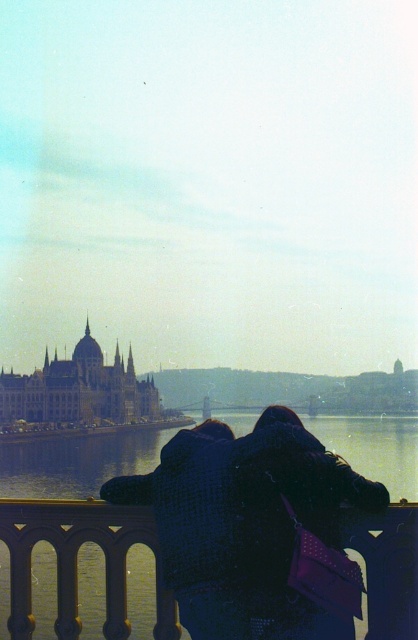
Is clear water at lower center further to camera compared to matte gold dome at center?

That is False.

What do you see at coordinates (73, 465) in the screenshot? I see `clear water at lower center` at bounding box center [73, 465].

Identify the location of clear water at lower center. Image resolution: width=418 pixels, height=640 pixels. (73, 465).

Can you confirm if clear water at lower center is positioned to the right of golden stone palace at lower left?

Yes, clear water at lower center is to the right of golden stone palace at lower left.

Is point (73, 458) positioned behind point (79, 356)?

No, it is in front of (79, 356).

This screenshot has height=640, width=418. Identify the location of clear water at lower center. (73, 465).

I want to click on clear water at lower center, so (x=73, y=465).

The width and height of the screenshot is (418, 640). Identify the location of golden stone palace at lower left. (79, 390).

Does golden stone palace at lower left appear under matte gold dome at center?

Indeed, golden stone palace at lower left is positioned under matte gold dome at center.

Which is in front, point (73, 385) or point (97, 365)?

Positioned in front is point (73, 385).

Identify the location of golden stone palace at lower left. This screenshot has height=640, width=418. (79, 390).